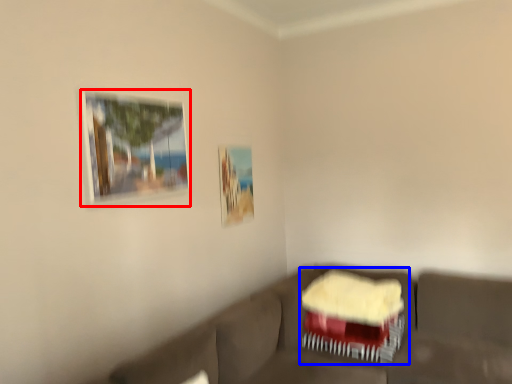
Question: Which of the following is the farthest to the observer, picture frame (highlighted by a red box) or swivel chair (highlighted by a blue box)?

Choices:
 (A) picture frame
 (B) swivel chair

Answer: (B)